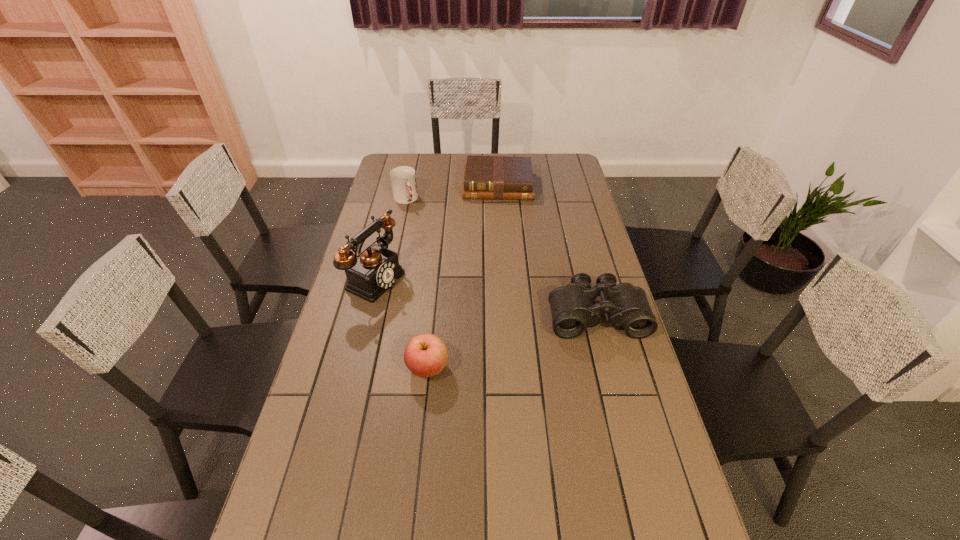
Image resolution: width=960 pixels, height=540 pixels. I want to click on vacant space situated on the spine side of the Bible, so click(498, 251).

The width and height of the screenshot is (960, 540). I want to click on free spot located 0.340m on the handle side of the cup, so click(438, 256).

The width and height of the screenshot is (960, 540). What are the coordinates of `free space located 0.130m on the handle side of the cup` in the screenshot? It's located at (419, 225).

The width and height of the screenshot is (960, 540). Find the location of `vacant position located 0.390m on the handle side of the cup`. vacant position located 0.390m on the handle side of the cup is located at coordinates (444, 264).

At what (x,y) coordinates should I click in order to perform the action: click on vacant space located 0.270m on the front of the tallest object at the rotary dial. Please return your answer as a coordinate pair (x, y). Looking at the image, I should click on pos(466,323).

Find the location of a particular element. This screenshot has width=960, height=540. free space located on the front of the tallest object at the rotary dial is located at coordinates (458, 320).

Find the location of a particular element. The image size is (960, 540). vacant space located on the front of the tallest object at the rotary dial is located at coordinates (440, 312).

Find the location of a particular element. This screenshot has height=540, width=960. object present at the far edge is located at coordinates (485, 177).

Locate an element on the screen. This screenshot has width=960, height=540. cup present at the left edge is located at coordinates (403, 178).

Locate an element on the screen. The height and width of the screenshot is (540, 960). telephone that is at the left edge is located at coordinates (x=376, y=269).